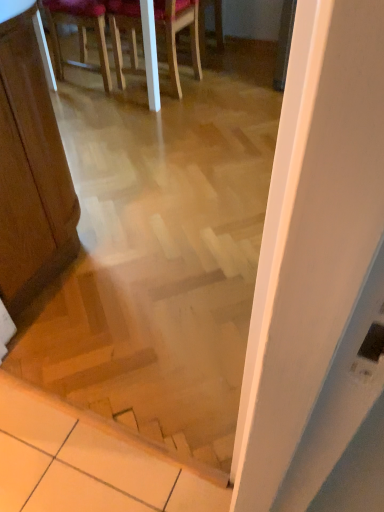
Image resolution: width=384 pixels, height=512 pixels. I want to click on free space between wooden chair at upper center, marked as the 2th chair in a right-to-left arrangement, and wooden stairs at center, so click(x=119, y=208).